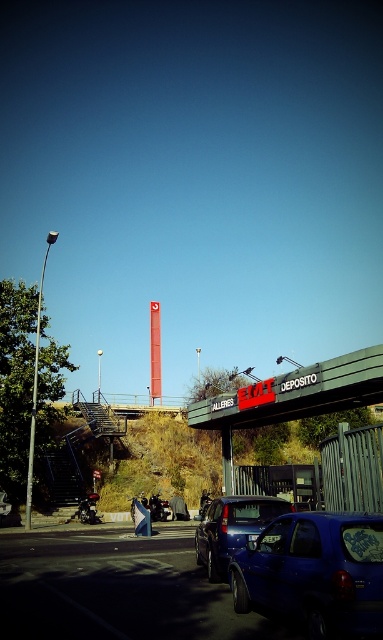
You are a delivery driver who needs to park your truck in the parking area shown. The truck requires a space that is at least 5 meters long. Based on the position of the metallic blue sedan at center, can you determine if there is enough space between it and the metal fence behind it?

Result: The metallic blue sedan at center is located at point (232,529). Without specific distance measurements between the sedan and the metal fence, it is impossible to determine if the space is sufficient for the truck. Please check the actual distance on site.

You are a delivery driver who needs to park your truck in this parking lot. Your truck is 2 meters tall. The glossy blue car at lower right and the metallic blue sedan at center are already parked here. Can you safely park your truck between them without hitting the vehicles?

The glossy blue car at lower right is much taller than the metallic blue sedan at center. Since your truck is 2 meters tall, you need to check the height clearance. However, the description only mentions the relative height between the two cars, not their actual heights. Without knowing the exact height of the taller car, it is uncertain if the truck can safely pass. You should measure or find the actual height requirements before parking.

You are a delivery driver who needs to back out of the parking spot. You see the glossy blue car at lower right and the metallic blue sedan at center. Which vehicle should you avoid hitting when backing out to the left?

The glossy blue car at lower right is to the right of the metallic blue sedan at center, so when backing out to the left, you should avoid hitting the metallic blue sedan at center which is closer to your left side.